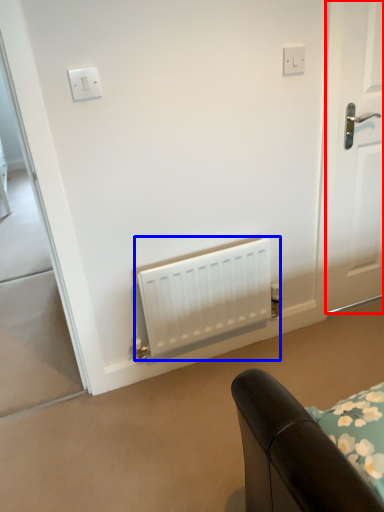
Question: Which of the following is the closest to the observer, door (highlighted by a red box) or radiator (highlighted by a blue box)?

Choices:
 (A) door
 (B) radiator

Answer: (A)